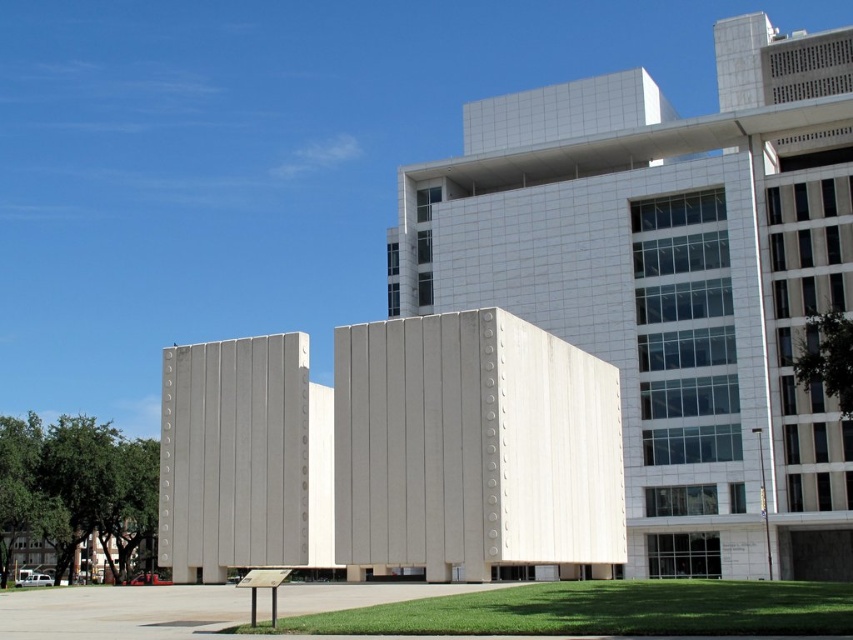
Question: Is smooth concrete building at center to the right of white concrete building at center from the viewer's perspective?

Choices:
 (A) no
 (B) yes

Answer: (B)

Question: Is smooth concrete building at center below white concrete building at center?

Choices:
 (A) yes
 (B) no

Answer: (B)

Question: Which object is farther from the camera taking this photo?

Choices:
 (A) white concrete building at center
 (B) smooth concrete building at center

Answer: (A)

Question: Can you confirm if smooth concrete building at center is wider than white concrete building at center?

Choices:
 (A) yes
 (B) no

Answer: (A)